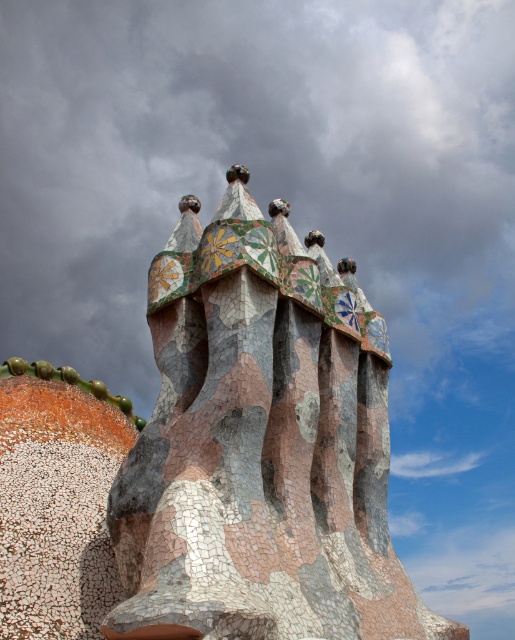
Is point (140, 20) more distant than point (213, 314)?

Yes, it is.

Does cloudy sky at upper center have a lesser width compared to mosaic tile spires at center?

No.

The width and height of the screenshot is (515, 640). Describe the element at coordinates (266, 173) in the screenshot. I see `cloudy sky at upper center` at that location.

This screenshot has width=515, height=640. Find the location of `cloudy sky at upper center`. cloudy sky at upper center is located at coordinates (266, 173).